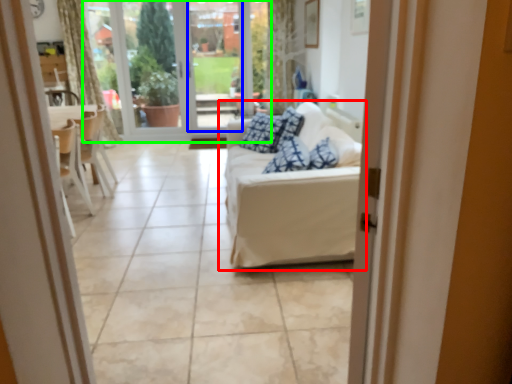
Question: Estimate the real-world distances between objects in this image. Which object is farther from studio couch (highlighted by a red box), window screen (highlighted by a blue box) or bay window (highlighted by a green box)?

Choices:
 (A) window screen
 (B) bay window

Answer: (B)